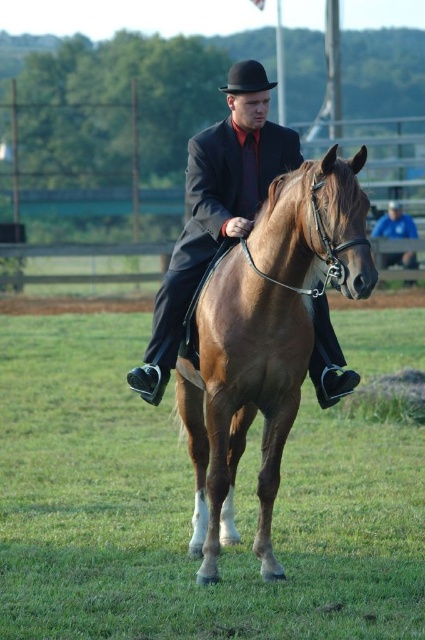
Who is taller, brown glossy horse at center or matte black suit at center?

brown glossy horse at center

Between brown glossy horse at center and matte black suit at center, which one is positioned higher?

Positioned higher is matte black suit at center.

Which is behind, point (359, 164) or point (291, 132)?

Point (291, 132)

Locate an element on the screen. The height and width of the screenshot is (640, 425). brown glossy horse at center is located at coordinates (265, 340).

What do you see at coordinates (189, 508) in the screenshot? I see `brown smooth horse at center` at bounding box center [189, 508].

Does brown smooth horse at center appear under brown glossy horse at center?

Yes, brown smooth horse at center is below brown glossy horse at center.

Find the location of `brown smooth horse at center`. brown smooth horse at center is located at coordinates (189, 508).

Can you confirm if brown smooth horse at center is thinner than black felt fedora at center?

No, brown smooth horse at center is not thinner than black felt fedora at center.

Does point (113, 444) come in front of point (265, 86)?

No, (113, 444) is further to viewer.

Measure the distance between point (405, 348) and camera.

Point (405, 348) and camera are 13.80 meters apart from each other.

Where is `brown smooth horse at center`? This screenshot has height=640, width=425. brown smooth horse at center is located at coordinates (189, 508).